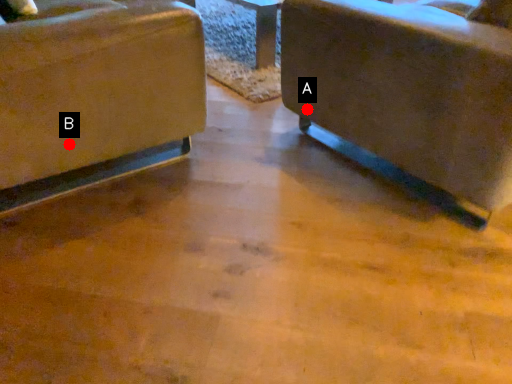
Question: Two points are circled on the image, labeled by A and B beside each circle. Which of the following is the farthest from the observer?

Choices:
 (A) A is further
 (B) B is further

Answer: (A)